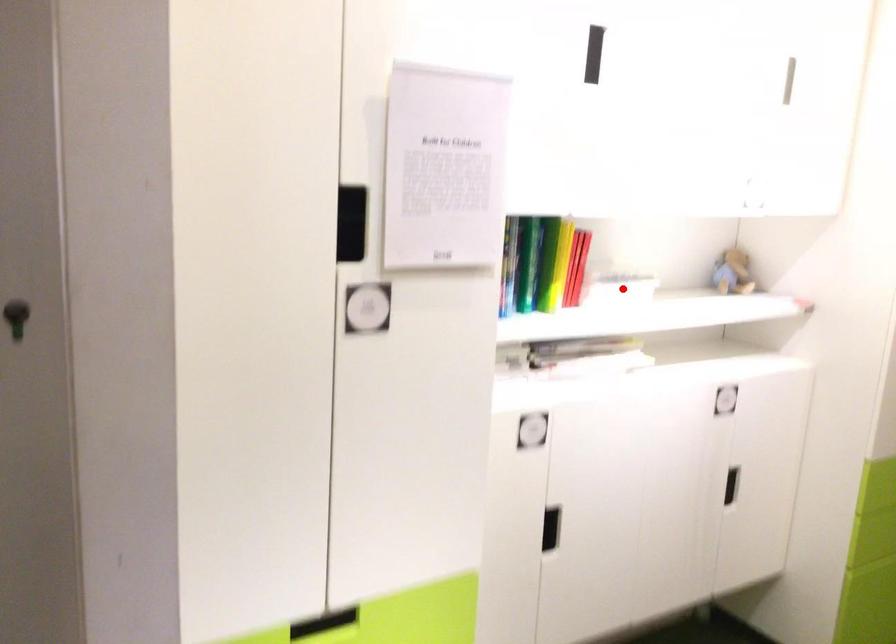
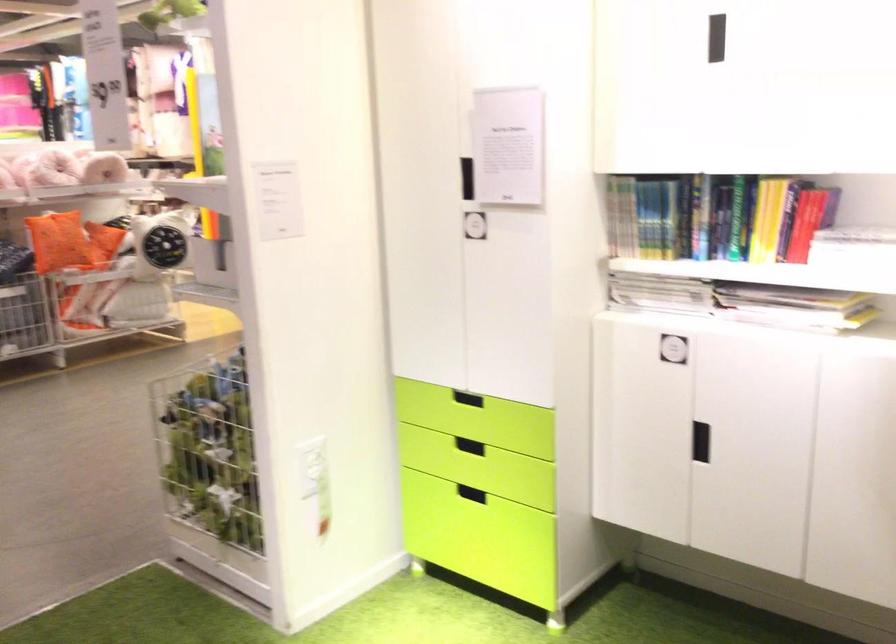
The point at the highlighted location is marked in the first image. Where is the corresponding point in the second image?

(853, 245)